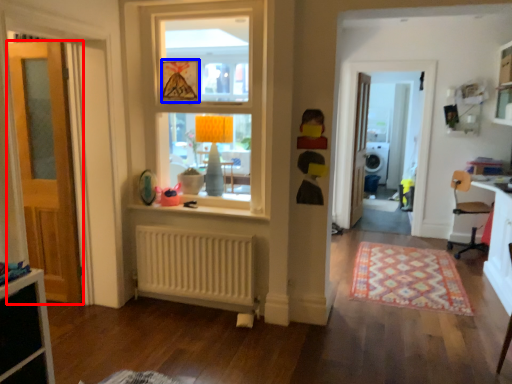
Question: Which of the following is the closest to the observer, door (highlighted by a red box) or picture frame (highlighted by a blue box)?

Choices:
 (A) door
 (B) picture frame

Answer: (A)